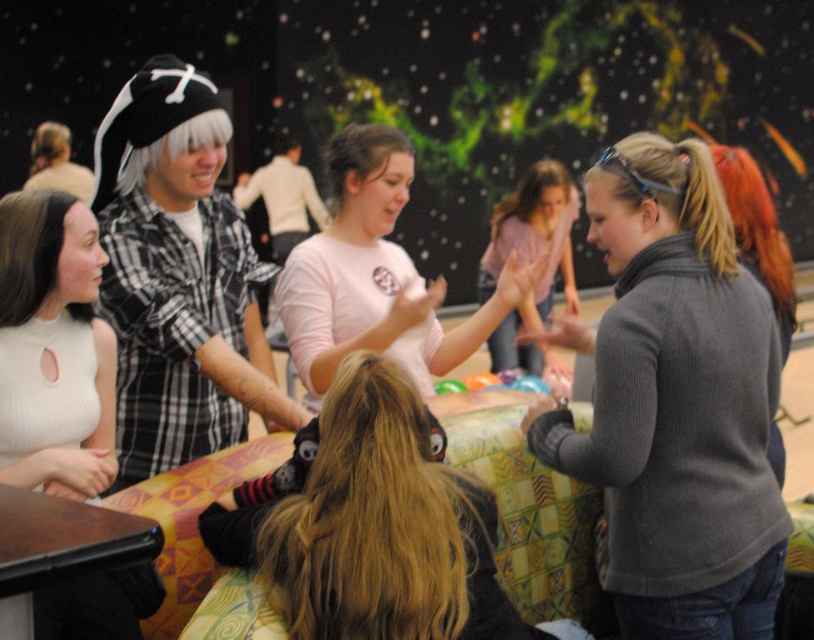
You are at the party and want to find the person with the white matte shirt at left. Where would you look relative to the blonde hair at center?

The white matte shirt at left is above the blonde hair at center, so look upwards from the blonde hair at center to find it.